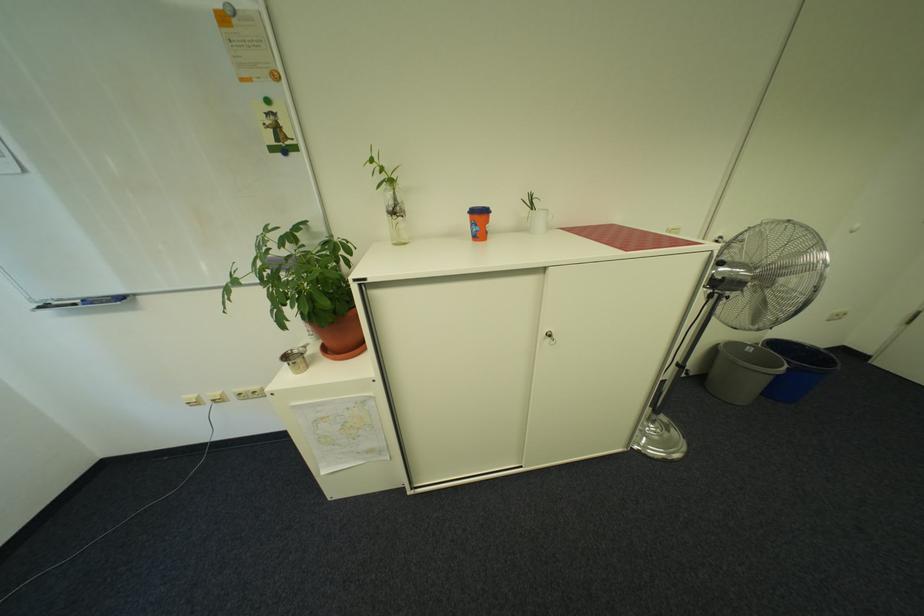
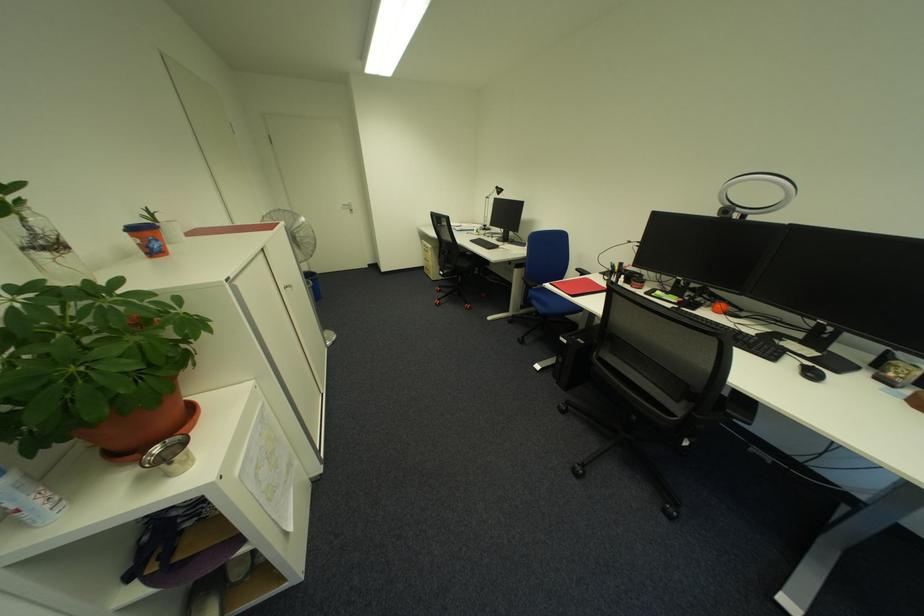
Locate, in the second image, the point that corresponds to pixel 487 229 in the first image.

(169, 244)